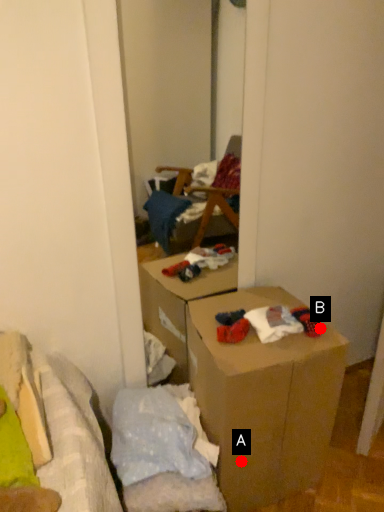
Question: Two points are circled on the image, labeled by A and B beside each circle. Which point is farther from the camera taking this photo?

Choices:
 (A) A is further
 (B) B is further

Answer: (B)